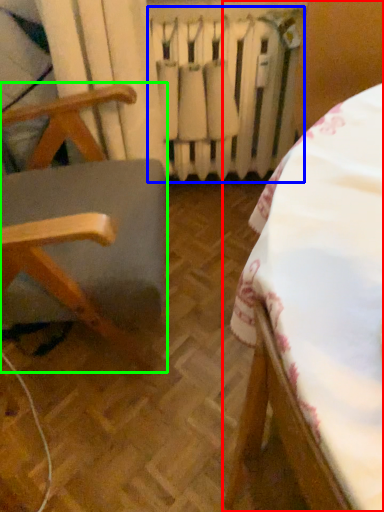
Question: Which object is the closest to the furniture (highlighted by a red box)? Choose among these: radiator (highlighted by a blue box) or furniture (highlighted by a green box).

Choices:
 (A) radiator
 (B) furniture

Answer: (B)